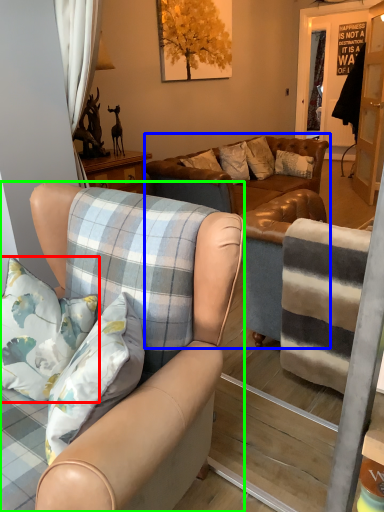
Question: Which is farther away from pillow (highlighted by a red box)? studio couch (highlighted by a blue box) or chair (highlighted by a green box)?

Choices:
 (A) studio couch
 (B) chair

Answer: (A)